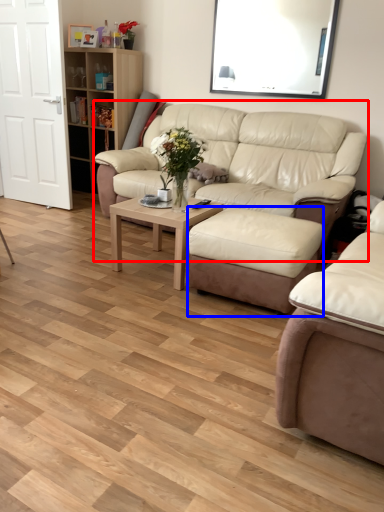
Question: Which of the following is the closest to the observer, studio couch (highlighted by a red box) or stool (highlighted by a blue box)?

Choices:
 (A) studio couch
 (B) stool

Answer: (B)